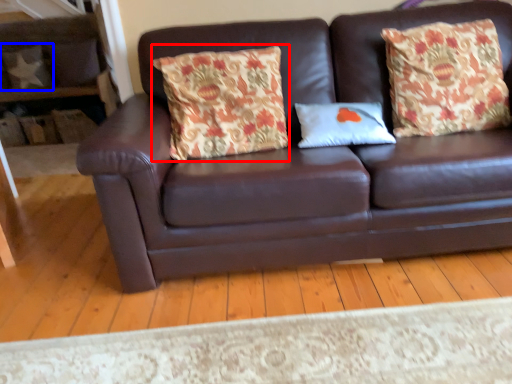
Question: Which of the following is the farthest to the observer, throw pillow (highlighted by a red box) or pillow (highlighted by a blue box)?

Choices:
 (A) throw pillow
 (B) pillow

Answer: (B)